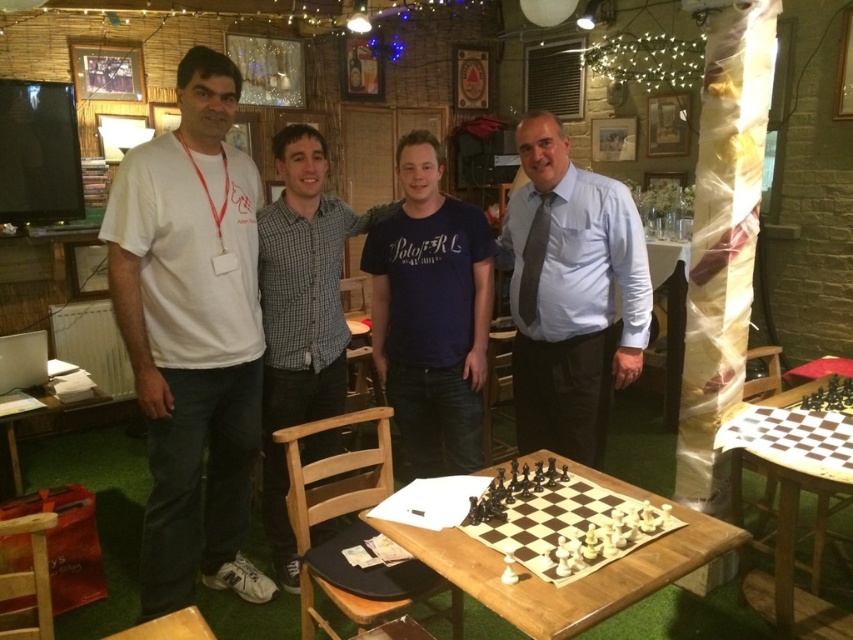
Looking at this image, does wooden chessboard at center appear on the left side of wooden chess set at center?

Yes, wooden chessboard at center is to the left of wooden chess set at center.

Between wooden chessboard at center and wooden chess set at center, which one appears on the right side from the viewer's perspective?

Positioned to the right is wooden chess set at center.

Is point (485, 604) positioned in front of point (606, 561)?

Yes.

Where is `wooden chessboard at center`? Image resolution: width=853 pixels, height=640 pixels. wooden chessboard at center is located at coordinates (573, 580).

Is point (738, 528) behind point (740, 417)?

No, (738, 528) is in front of (740, 417).

Does wooden chessboard at center appear over wooden chessboard at lower right?

Correct, wooden chessboard at center is located above wooden chessboard at lower right.

Identify the location of wooden chessboard at center. (573, 580).

Which is more to the left, light blue shirt at center or wooden chess set at center?

From the viewer's perspective, wooden chess set at center appears more on the left side.

Describe the element at coordinates (570, 294) in the screenshot. I see `light blue shirt at center` at that location.

Identify the location of light blue shirt at center. The height and width of the screenshot is (640, 853). (570, 294).